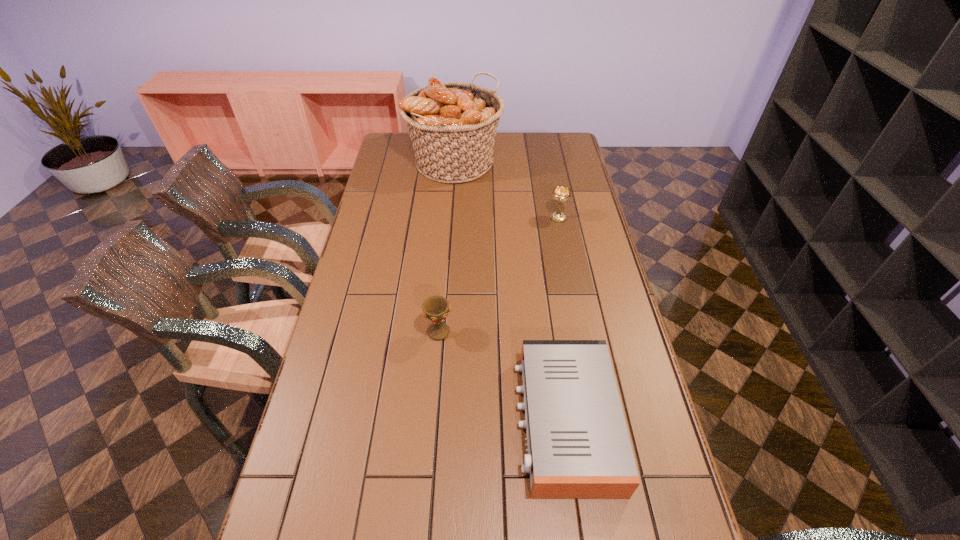
Identify the location of vacant space at the left edge. (404, 199).

At what (x,y) coordinates should I click in order to perform the action: click on blank space at the right edge of the desktop. Please return your answer as a coordinate pair (x, y). The height and width of the screenshot is (540, 960). Looking at the image, I should click on (551, 202).

Locate an element on the screen. The height and width of the screenshot is (540, 960). free space between the radio receiver and the right chalice is located at coordinates (562, 319).

The image size is (960, 540). In order to click on unoccupied position between the left chalice and the right chalice in this screenshot , I will do [x=498, y=275].

You are a GUI agent. You are given a task and a screenshot of the screen. Output one action in this format:
    pyautogui.click(x=<x>, y=<y>)
    Task: Click on the free spot between the shortest object and the nearer chalice
    
    Given the screenshot: What is the action you would take?
    tap(502, 376)

This screenshot has height=540, width=960. In order to click on free space between the nearest object and the second nearest object in this screenshot , I will do pyautogui.click(x=502, y=376).

The width and height of the screenshot is (960, 540). I want to click on free space between the third farthest object and the tallest object, so click(x=446, y=247).

Find the location of a particular element. The image size is (960, 540). vacant space in between the shortest object and the farther chalice is located at coordinates (562, 319).

Identify the location of free space between the nearer chalice and the shortest object. Image resolution: width=960 pixels, height=540 pixels. (502, 376).

At what (x,y) coordinates should I click in order to perform the action: click on free spot between the farthest object and the right chalice. Please return your answer as a coordinate pair (x, y). Looking at the image, I should click on (506, 191).